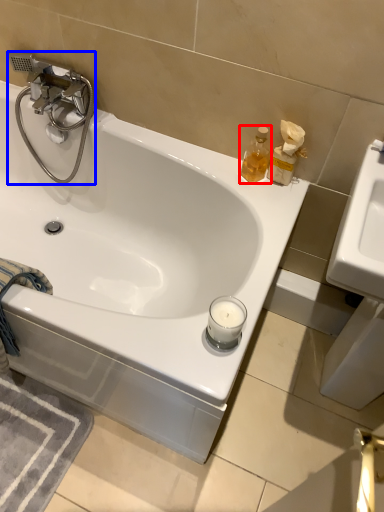
Question: Which point is further to the camera, soap dispenser (highlighted by a red box) or tap (highlighted by a blue box)?

Choices:
 (A) soap dispenser
 (B) tap

Answer: (B)